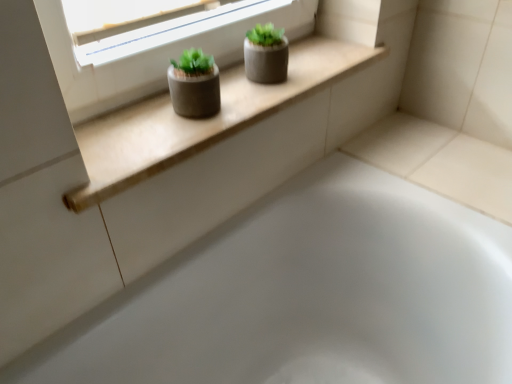
Where is `vacant space situated above beige wood window sill at upper center (from a real-world perspective)`? This screenshot has width=512, height=384. vacant space situated above beige wood window sill at upper center (from a real-world perspective) is located at coordinates (233, 91).